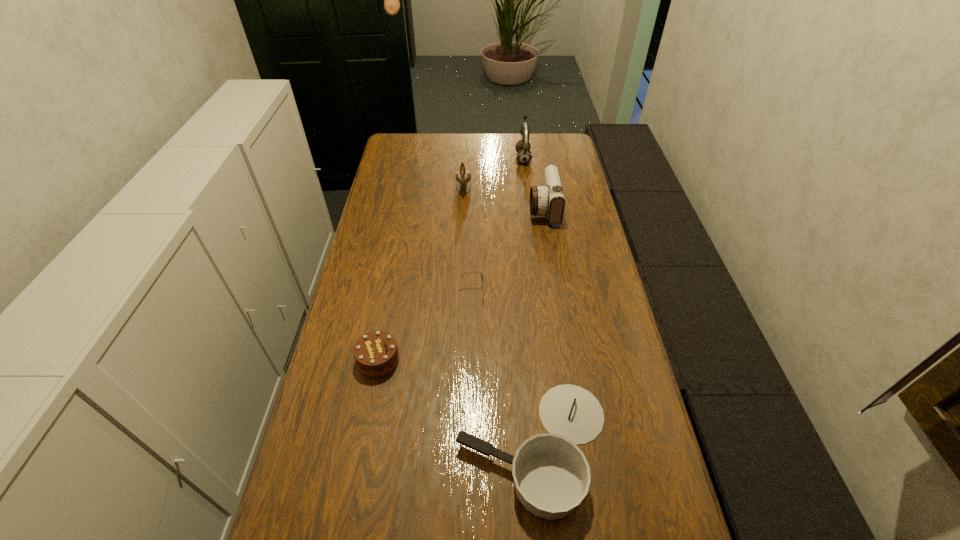
The width and height of the screenshot is (960, 540). What are the coordinates of `vacant space that satisfies the following two spatial constraints: 1. at the face of the bird; 2. on the right side of the nearest object` in the screenshot? It's located at (452, 447).

The image size is (960, 540). In order to click on vacant point that satisfies the following two spatial constraints: 1. on the ear pads of the farthest object; 2. at the face of the bird in this screenshot , I will do `click(526, 184)`.